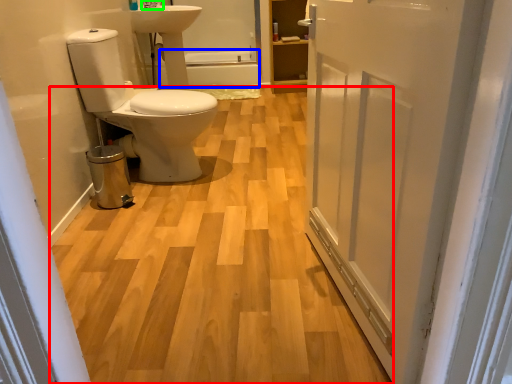
Question: Which is nearer to the plain (highlighted by a red box)? bath (highlighted by a blue box) or tap (highlighted by a green box).

Choices:
 (A) bath
 (B) tap

Answer: (B)